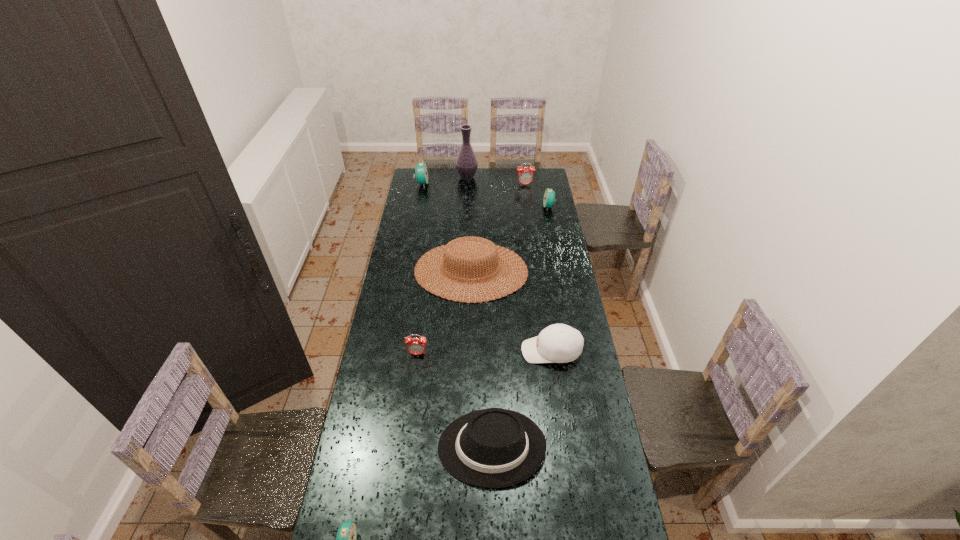
Find the location of a particular element. The height and width of the screenshot is (540, 960). object located in the far right corner section of the desktop is located at coordinates tap(525, 176).

Locate an element on the screen. This screenshot has width=960, height=540. vacant space at the far edge is located at coordinates (457, 176).

Identify the location of free space at the left edge of the desktop. The image size is (960, 540). (404, 232).

At what (x,y) coordinates should I click in order to perform the action: click on vacant space at the right edge of the desktop. Please return your answer as a coordinate pair (x, y). The width and height of the screenshot is (960, 540). Looking at the image, I should click on (577, 429).

Locate an element on the screen. Image resolution: width=960 pixels, height=540 pixels. empty space between the right red alarm clock and the fedora is located at coordinates tap(508, 316).

This screenshot has width=960, height=540. I want to click on vacant space that's between the right red alarm clock and the rightmost alarm clock, so click(537, 196).

Locate an element on the screen. This screenshot has height=540, width=960. vacant space that's between the second nearest alarm clock and the white baseball cap is located at coordinates (485, 353).

Find the location of a particular element. vacant area that lies between the fourth alarm clock from left to right and the baseball cap is located at coordinates (539, 268).

Image resolution: width=960 pixels, height=540 pixels. I want to click on vacant space that's between the sixth nearest object and the tallest object, so click(x=508, y=192).

Find the location of a particular element. Image resolution: width=960 pixels, height=540 pixels. blank region between the fedora and the sunhat is located at coordinates (481, 359).